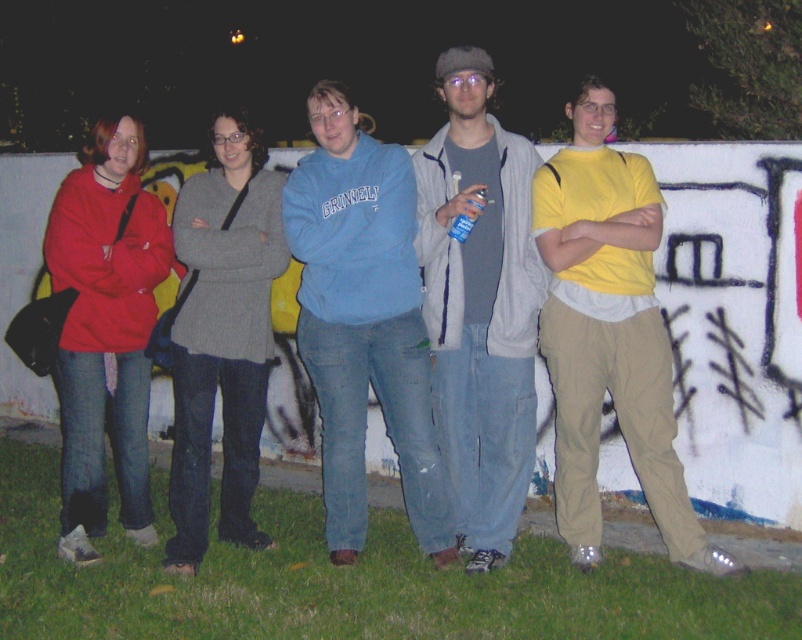
Question: Does yellow cotton shirt at center appear under matte gray jacket at center?

Choices:
 (A) no
 (B) yes

Answer: (B)

Question: In this image, where is yellow cotton shirt at center located relative to blue sweatshirt at center?

Choices:
 (A) below
 (B) above

Answer: (A)

Question: Which is nearer to the matte gray jacket at center?

Choices:
 (A) yellow cotton shirt at center
 (B) blue sweatshirt at center

Answer: (B)

Question: Which point is farther to the camera?

Choices:
 (A) (399, 420)
 (B) (634, 355)
 (C) (472, 531)

Answer: (C)

Question: Which is farther from the matte gray jacket at center?

Choices:
 (A) yellow cotton shirt at center
 (B) blue sweatshirt at center

Answer: (A)

Question: Does yellow cotton shirt at center appear under blue sweatshirt at center?

Choices:
 (A) no
 (B) yes

Answer: (B)